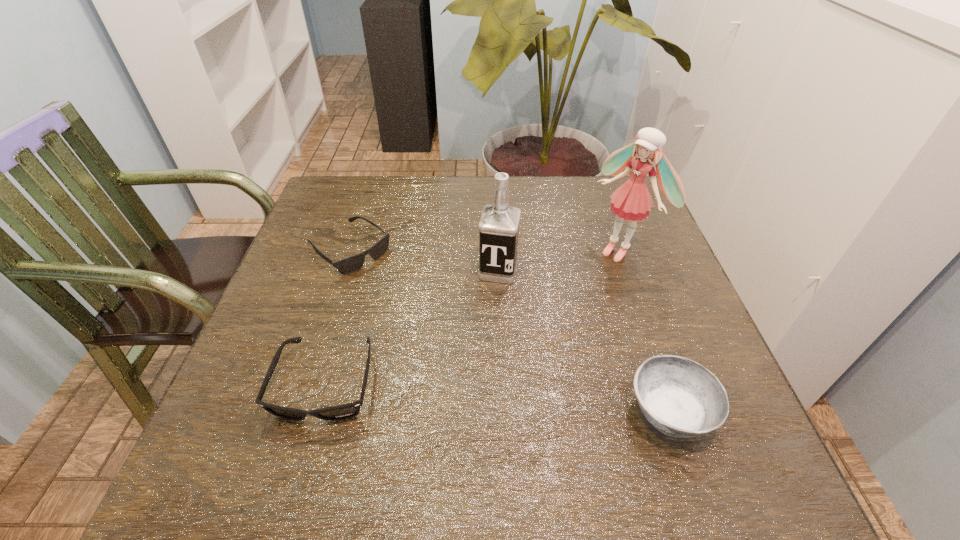
This screenshot has width=960, height=540. In order to click on object that is the closest one to the shortest object in this screenshot , I will do `click(340, 412)`.

This screenshot has height=540, width=960. In order to click on object that stands as the third closest to the fourth tallest object in this screenshot , I will do `click(681, 398)`.

Identify the location of vacant area that satisfies the following two spatial constraints: 1. on the front side of the ashtray; 2. on the right side of the farther sunglasses. The height and width of the screenshot is (540, 960). (295, 412).

Where is `vacant area that satisfies the following two spatial constraints: 1. on the back side of the ashtray; 2. on the right side of the doll`? The width and height of the screenshot is (960, 540). vacant area that satisfies the following two spatial constraints: 1. on the back side of the ashtray; 2. on the right side of the doll is located at coordinates (614, 249).

This screenshot has width=960, height=540. What are the coordinates of `free space in the image that satisfies the following two spatial constraints: 1. on the back side of the doll; 2. on the right side of the ashtray` in the screenshot? It's located at (614, 249).

The height and width of the screenshot is (540, 960). In order to click on vacant position in the image that satisfies the following two spatial constraints: 1. on the front-facing side of the ashtray; 2. on the left side of the nearer sunglasses in this screenshot , I will do `click(319, 412)`.

Locate an element on the screen. The height and width of the screenshot is (540, 960). free spot that satisfies the following two spatial constraints: 1. on the back side of the tallest object; 2. on the left side of the third object from right to left is located at coordinates (497, 249).

The height and width of the screenshot is (540, 960). Identify the location of free space that satisfies the following two spatial constraints: 1. on the front-facing side of the nearer sunglasses; 2. on the right side of the ashtray. click(x=319, y=412).